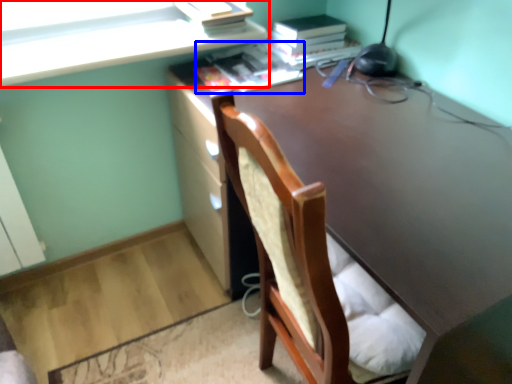
Question: Which of the following is the farthest to the observer, cabinetry (highlighted by a red box) or book (highlighted by a blue box)?

Choices:
 (A) cabinetry
 (B) book

Answer: (B)